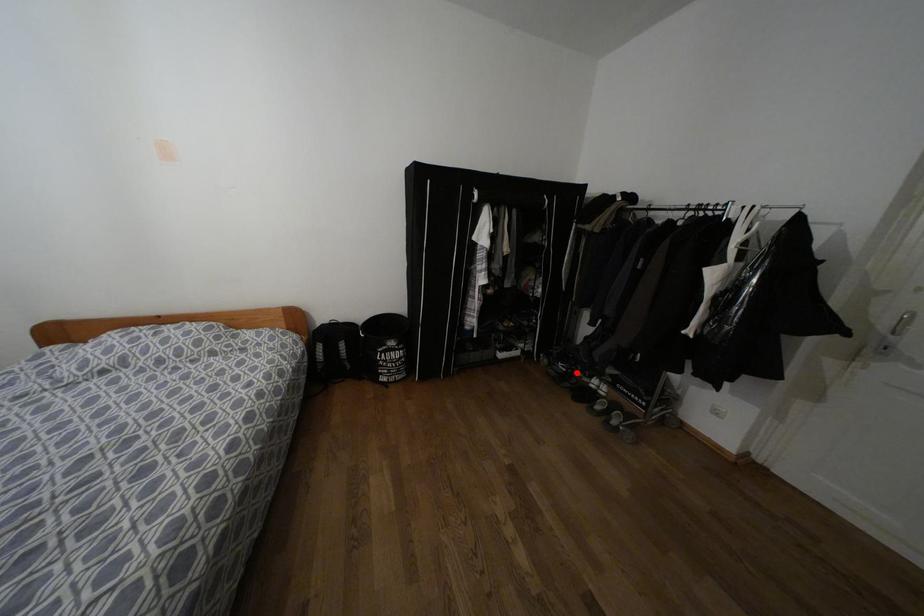
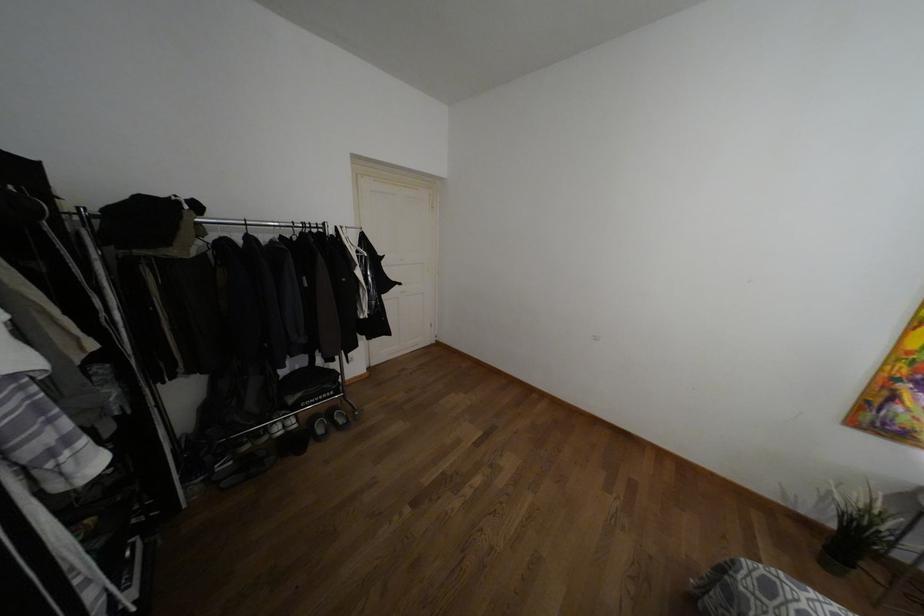
Question: I am providing you with two images of the same scene from different viewpoints. Given a red point in image1, look at the same physical point in image2. Is it:

Choices:
 (A) Closer to the viewpoint
 (B) Farther from the viewpoint

Answer: (B)